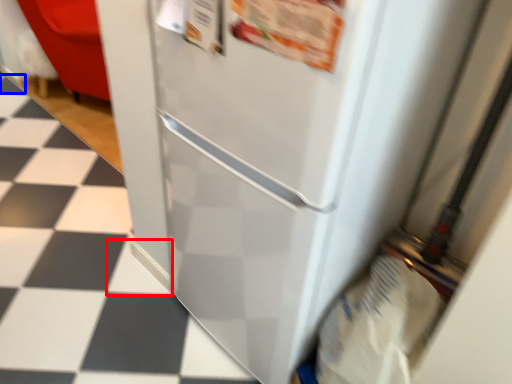
Question: Which point is further to the camera, tile (highlighted by a red box) or tile (highlighted by a blue box)?

Choices:
 (A) tile
 (B) tile

Answer: (B)